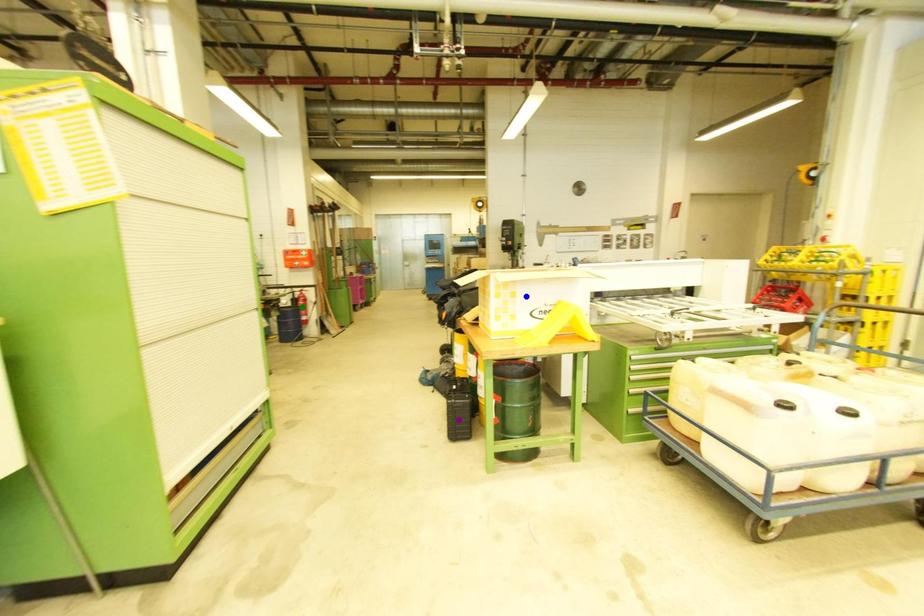
Looking at this image, order these from farthest to nearest:
blue point, green point, purple point

green point → purple point → blue point